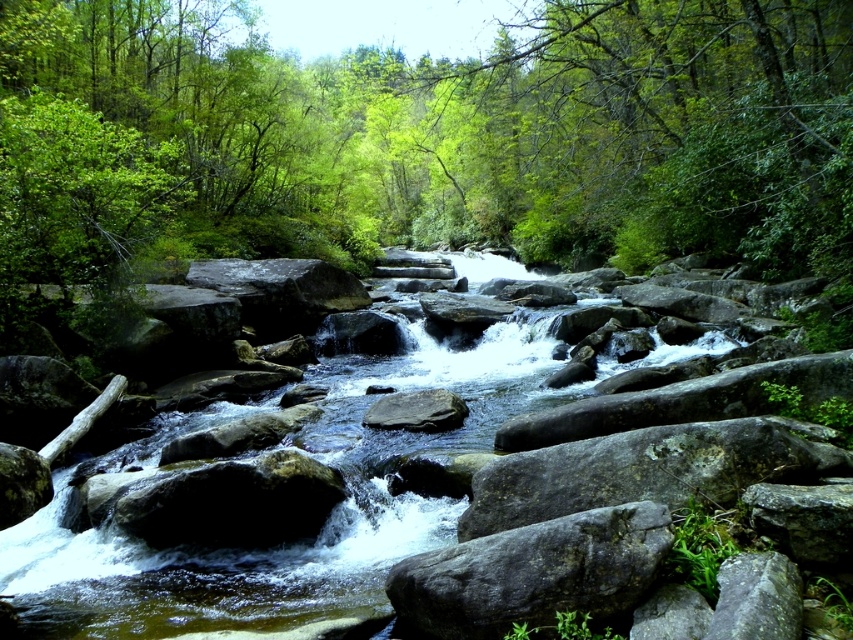
Question: Considering the real-world distances, which object is farthest from the dark gray rock at center?

Choices:
 (A) gray rough rock at center
 (B) smooth gray rock at center

Answer: (B)

Question: Does gray mossy rock at center have a lesser width compared to dark gray rock at center?

Choices:
 (A) yes
 (B) no

Answer: (B)

Question: Is gray rough rock at center wider than dark gray rock at center?

Choices:
 (A) yes
 (B) no

Answer: (B)

Question: Which point is farther to the camera?

Choices:
 (A) (434, 429)
 (B) (556, 488)
 (C) (334, 481)

Answer: (A)

Question: Which point is closer to the camera?

Choices:
 (A) smooth gray rock at center
 (B) gray rough rock at center

Answer: (B)

Question: Is gray rough rock at center wider than dark gray rock at center?

Choices:
 (A) yes
 (B) no

Answer: (B)